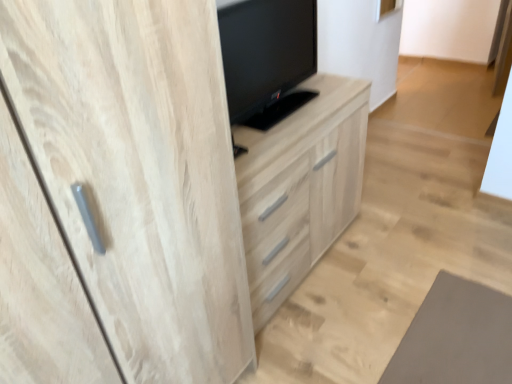
Where is `free location in front of light wood cabinet at center`? free location in front of light wood cabinet at center is located at coordinates (345, 334).